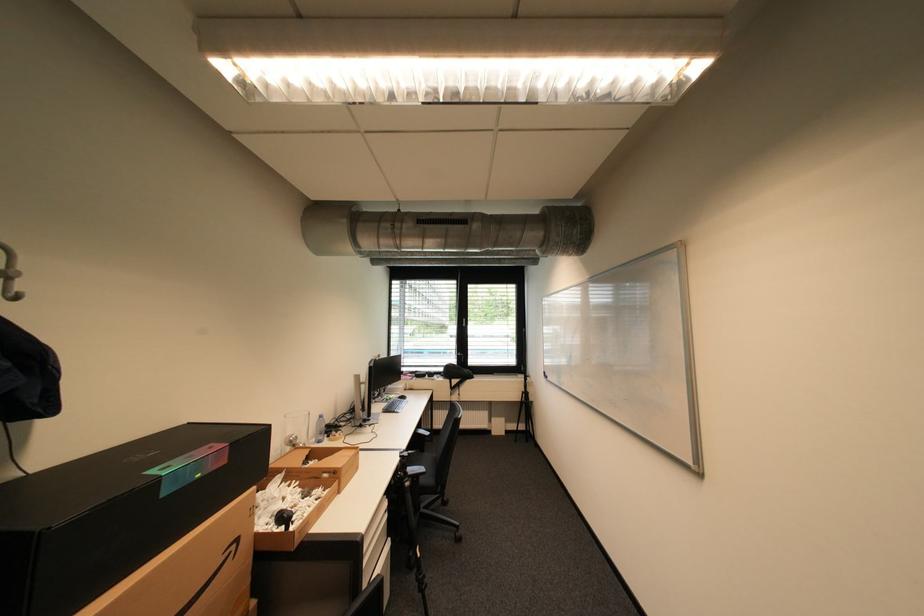
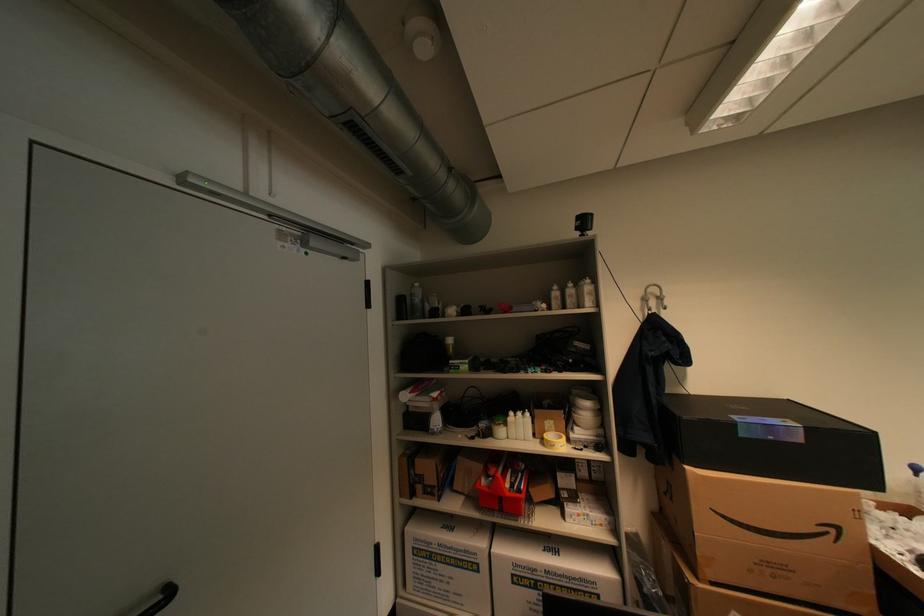
In the second image, find the point that corresponds to point (260, 559) in the first image.

(879, 568)